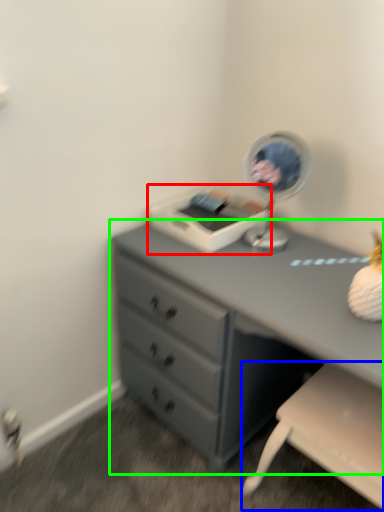
Question: Estimate the real-world distances between objects in this image. Which object is farther from printer (highlighted by a red box), swivel chair (highlighted by a blue box) or chest of drawers (highlighted by a green box)?

Choices:
 (A) swivel chair
 (B) chest of drawers

Answer: (A)